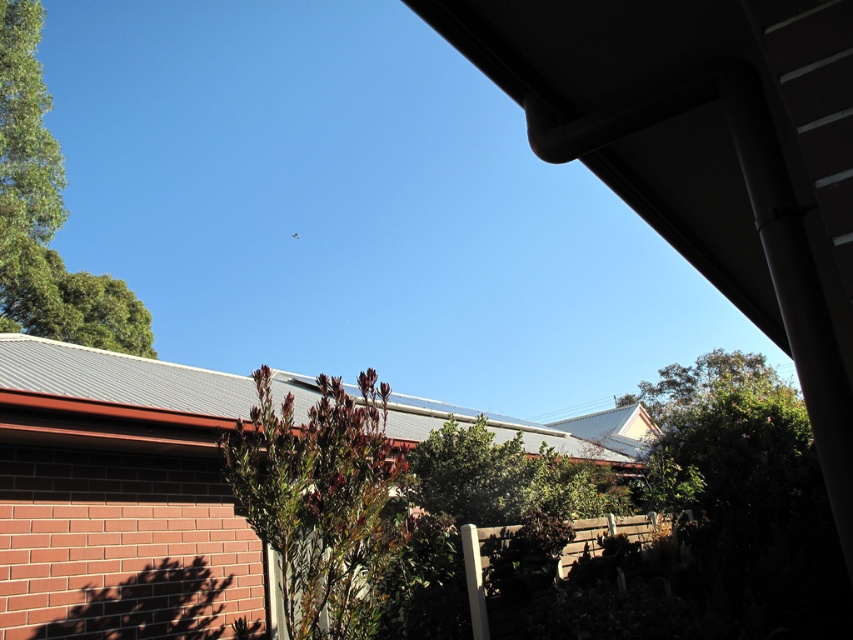
Question: Which point is closer to the camera taking this photo?

Choices:
 (A) (318, 400)
 (B) (91, 314)

Answer: (A)

Question: Does green leafy bush at center have a larger size compared to green leafy tree at upper left?

Choices:
 (A) no
 (B) yes

Answer: (A)

Question: Is green leafy bush at center to the left of green leafy tree at upper left from the viewer's perspective?

Choices:
 (A) no
 (B) yes

Answer: (A)

Question: Can you confirm if green leafy bush at center is thinner than green leafy tree at upper left?

Choices:
 (A) no
 (B) yes

Answer: (B)